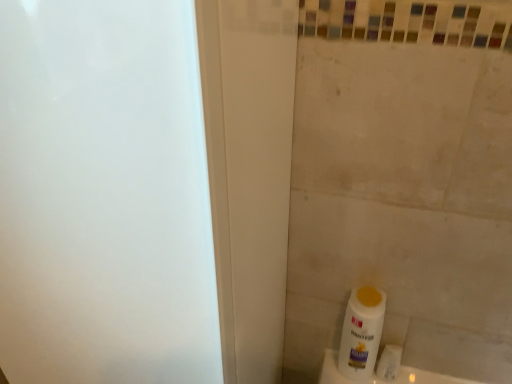
Question: In terms of height, does white matte toilet paper at lower right look taller or shorter compared to white plastic bottle at lower right?

Choices:
 (A) tall
 (B) short

Answer: (B)

Question: From the image's perspective, relative to white plastic bottle at lower right, is white matte toilet paper at lower right above or below?

Choices:
 (A) above
 (B) below

Answer: (B)

Question: Considering the relative positions of white matte toilet paper at lower right and white plastic bottle at lower right in the image provided, is white matte toilet paper at lower right to the left or to the right of white plastic bottle at lower right?

Choices:
 (A) right
 (B) left

Answer: (A)

Question: Considering the positions of white plastic bottle at lower right and white matte toilet paper at lower right in the image, is white plastic bottle at lower right wider or thinner than white matte toilet paper at lower right?

Choices:
 (A) wide
 (B) thin

Answer: (A)

Question: Considering the positions of point coord(372,307) and point coord(390,375), is point coord(372,307) closer or farther from the camera than point coord(390,375)?

Choices:
 (A) farther
 (B) closer

Answer: (B)

Question: From their relative heights in the image, would you say white plastic bottle at lower right is taller or shorter than white matte toilet paper at lower right?

Choices:
 (A) short
 (B) tall

Answer: (B)

Question: Which is correct: white plastic bottle at lower right is inside white matte toilet paper at lower right, or outside of it?

Choices:
 (A) inside
 (B) outside

Answer: (B)